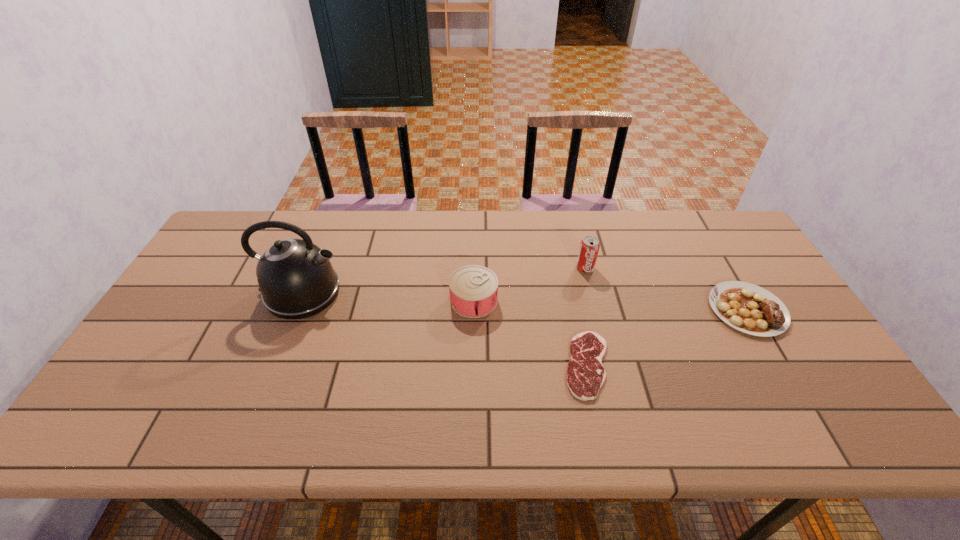
Image resolution: width=960 pixels, height=540 pixels. Find the location of `the tallest object`. the tallest object is located at coordinates (296, 279).

The width and height of the screenshot is (960, 540). In order to click on the leftmost object in this screenshot , I will do `click(296, 279)`.

Image resolution: width=960 pixels, height=540 pixels. Find the location of `the second tallest object`. the second tallest object is located at coordinates (589, 247).

Where is `the fourth object from right to left`? The width and height of the screenshot is (960, 540). the fourth object from right to left is located at coordinates (473, 289).

Where is `can`? The width and height of the screenshot is (960, 540). can is located at coordinates (473, 289).

Where is `the rightmost object`? Image resolution: width=960 pixels, height=540 pixels. the rightmost object is located at coordinates (751, 309).

The width and height of the screenshot is (960, 540). I want to click on the right steak, so click(751, 309).

Where is `the left steak`? The image size is (960, 540). the left steak is located at coordinates pos(585,375).

The image size is (960, 540). Find the location of `the shortest object`. the shortest object is located at coordinates (585, 375).

I want to click on free point located on the spout of the kettle, so (381, 293).